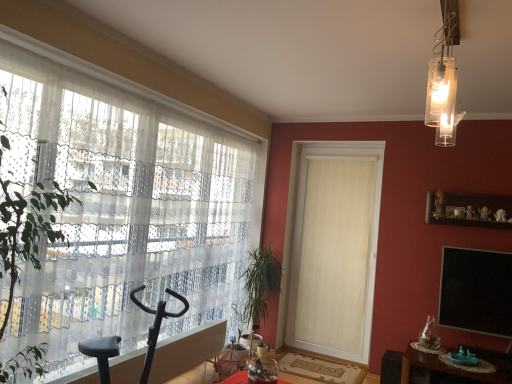
Question: Is green leafy plant at left touching clear glass pendant light at upper right?

Choices:
 (A) no
 (B) yes

Answer: (A)

Question: Does green leafy plant at left come in front of clear glass pendant light at upper right?

Choices:
 (A) no
 (B) yes

Answer: (B)

Question: From the image's perspective, is green leafy plant at left located beneath clear glass pendant light at upper right?

Choices:
 (A) no
 (B) yes

Answer: (B)

Question: Is green leafy plant at left looking in the opposite direction of clear glass pendant light at upper right?

Choices:
 (A) yes
 (B) no

Answer: (B)

Question: Considering the relative sizes of green leafy plant at left and clear glass pendant light at upper right in the image provided, is green leafy plant at left bigger than clear glass pendant light at upper right?

Choices:
 (A) no
 (B) yes

Answer: (B)

Question: Does green leafy plant at left have a smaller size compared to clear glass pendant light at upper right?

Choices:
 (A) yes
 (B) no

Answer: (B)

Question: From a real-world perspective, is white textured door at center physically above white sheer curtain at left?

Choices:
 (A) yes
 (B) no

Answer: (B)

Question: Does white textured door at center have a greater height compared to white sheer curtain at left?

Choices:
 (A) yes
 (B) no

Answer: (A)

Question: Does white textured door at center lie behind white sheer curtain at left?

Choices:
 (A) no
 (B) yes

Answer: (B)

Question: Does white textured door at center have a lesser height compared to white sheer curtain at left?

Choices:
 (A) yes
 (B) no

Answer: (B)

Question: Considering the relative positions of white textured door at center and white sheer curtain at left in the image provided, is white textured door at center to the right of white sheer curtain at left from the viewer's perspective?

Choices:
 (A) no
 (B) yes

Answer: (B)

Question: Considering the relative sizes of white textured door at center and white sheer curtain at left in the image provided, is white textured door at center smaller than white sheer curtain at left?

Choices:
 (A) yes
 (B) no

Answer: (A)

Question: Considering the relative sizes of green leafy plant at center and white textured door at center in the image provided, is green leafy plant at center taller than white textured door at center?

Choices:
 (A) yes
 (B) no

Answer: (B)